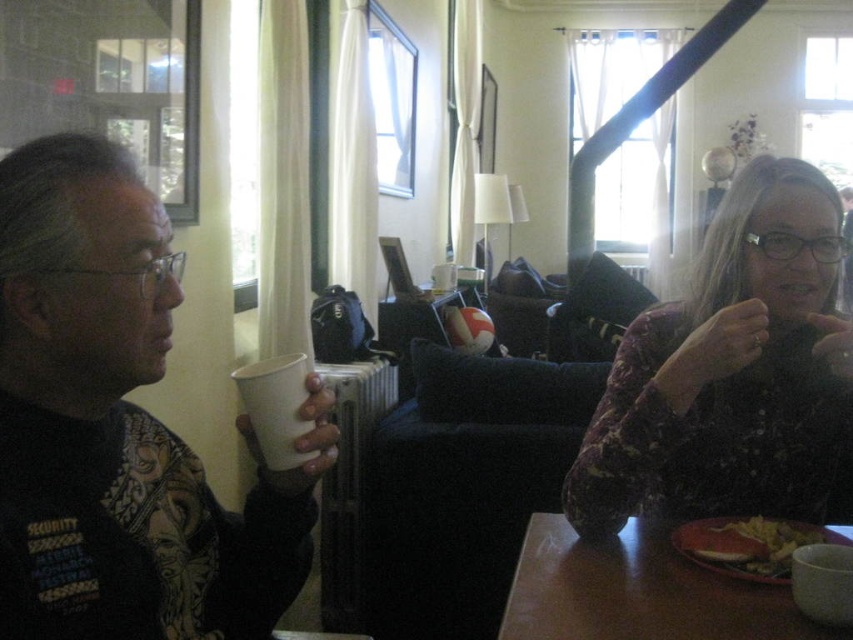
You are arranging items on a shelf in the living room. The shelf has limited vertical space. You need to place both the white paper cup at left and the matte purple sweater at right. Which item should you place higher up to ensure they both fit on the shelf?

The white paper cup at left is below the matte purple sweater at right, so to fit both on the shelf with limited vertical space, place the matte purple sweater at right higher up and the white paper cup at left lower down.

You are planning to place a small plant between the white paper cup at left and the matte purple sweater at right. Based on their positions, which object should the plant be closer to?

The white paper cup at left is to the left of the matte purple sweater at right, so the plant should be placed closer to the matte purple sweater at right to center it between them.